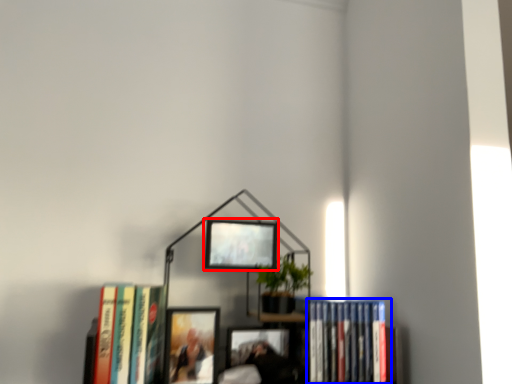
Question: Which object appears farthest to the camera in this image, picture frame (highlighted by a red box) or book (highlighted by a blue box)?

Choices:
 (A) picture frame
 (B) book

Answer: (B)